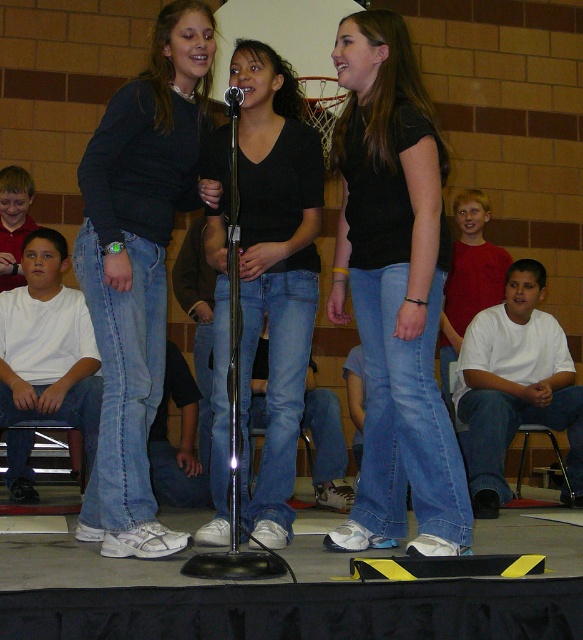
You are an event photographer trying to capture a candid shot of the speaker. You notice the matte red shirt at left and the metallic silver microphone at center. Which object should you focus on to ensure the speaker is in the frame?

The metallic silver microphone at center is where the speaker is focused, so focusing on it will ensure the speaker is in the frame.

Consider the image. You are a photographer standing in the gymnasium and want to take a photo of the matte red shirt at left. Where should you position yourself to capture the best shot?

To capture the best shot of the matte red shirt at left, position yourself directly in front of the matte red shirt at left at point (13, 221) to ensure it is centered and in focus.